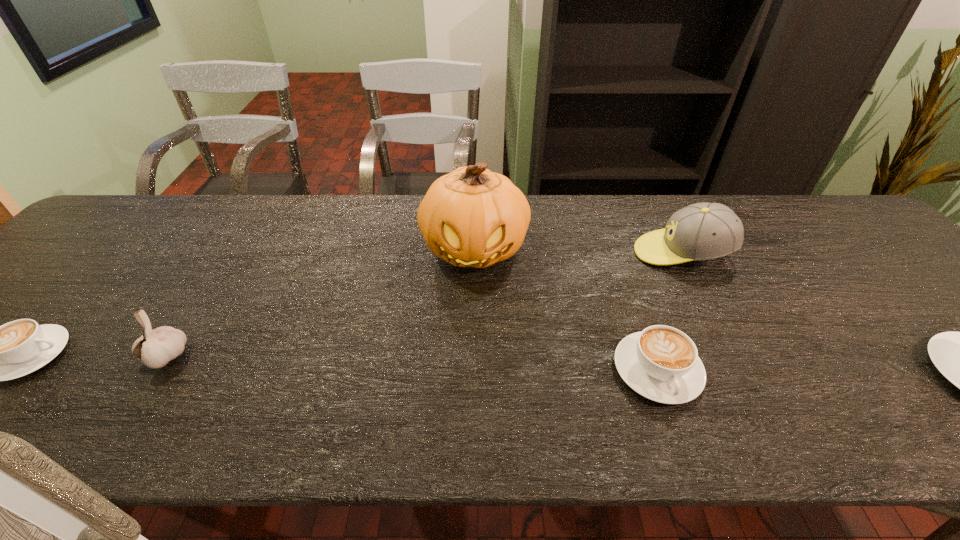
To make them evenly spaced by inserting another cappuccino among them, please locate a free space for this new cappuccino. Please provide its 2D coordinates. Your answer should be formatted as a tuple, i.e. [(x, y)], where the tuple contains the x and y coordinates of a point satisfying the conditions above.

[(339, 362)]